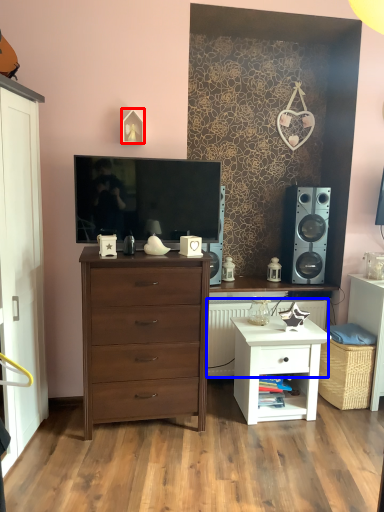
Question: Which of the following is the farthest to the observer, picture frame (highlighted by a red box) or radiator (highlighted by a blue box)?

Choices:
 (A) picture frame
 (B) radiator

Answer: (B)